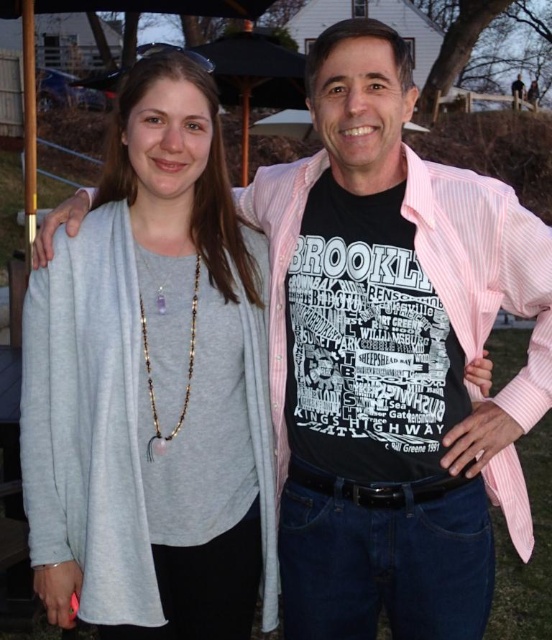
Question: Can you confirm if gray soft sweater at center is thinner than amber beaded necklace at center?

Choices:
 (A) no
 (B) yes

Answer: (A)

Question: Among these points, which one is farthest from the camera?

Choices:
 (A) (205, 417)
 (B) (193, 355)

Answer: (A)

Question: Does gray soft sweater at center appear on the left side of amber beaded necklace at center?

Choices:
 (A) yes
 (B) no

Answer: (A)

Question: Which object appears farthest from the camera in this image?

Choices:
 (A) amber beaded necklace at center
 (B) gray soft sweater at center

Answer: (A)

Question: Does gray soft sweater at center appear under amber beaded necklace at center?

Choices:
 (A) yes
 (B) no

Answer: (A)